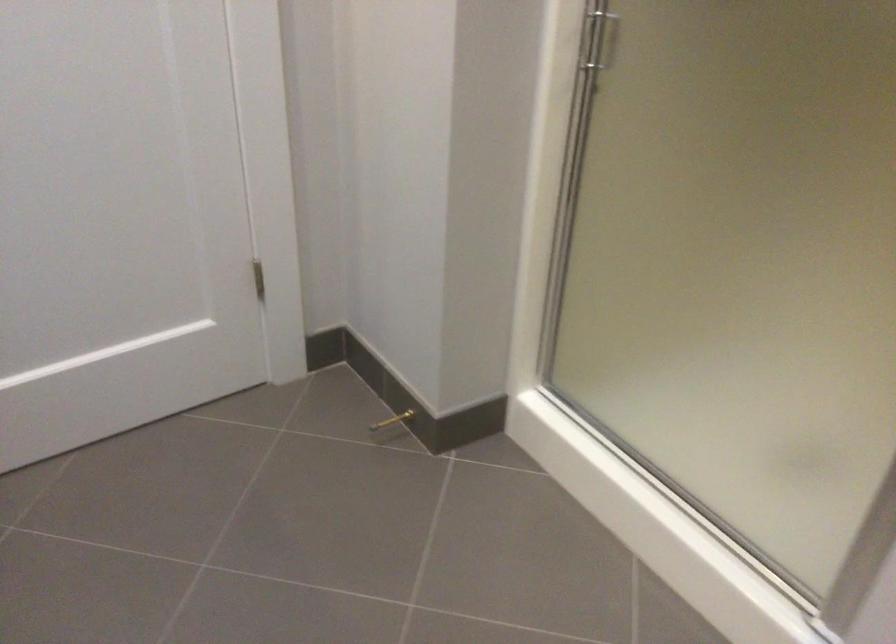
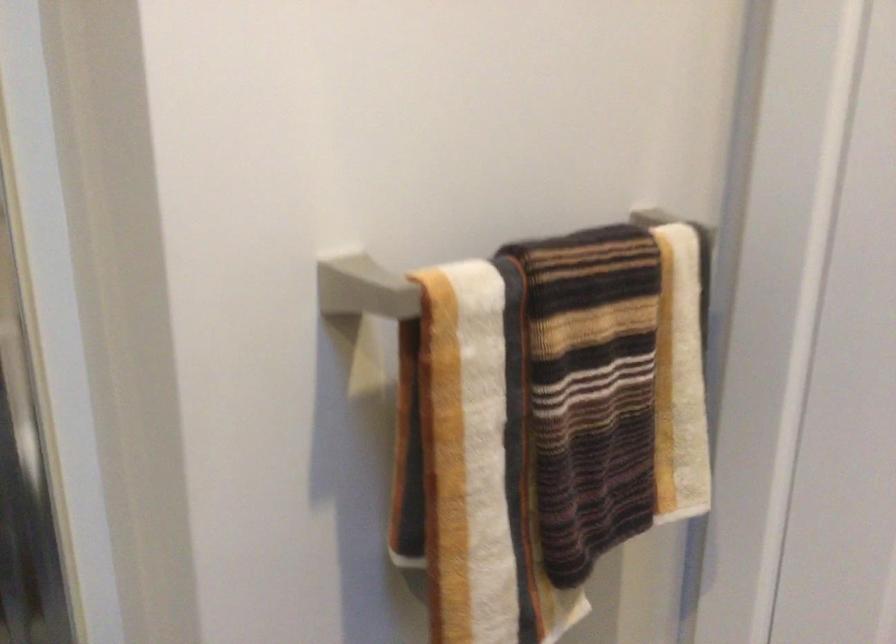
Based on the continuous images, in which direction is the camera rotating?

The camera's rotation is toward right-down.